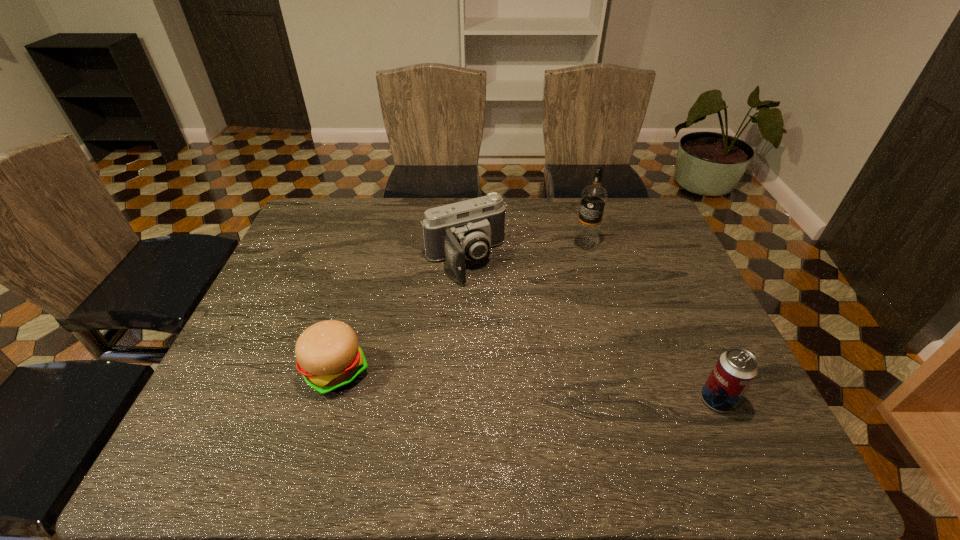
Identify the location of free point at the far edge. The height and width of the screenshot is (540, 960). (507, 205).

Locate an element on the screen. This screenshot has height=540, width=960. blank space at the near edge of the desktop is located at coordinates (468, 389).

The height and width of the screenshot is (540, 960). I want to click on free location at the left edge of the desktop, so click(x=275, y=323).

Find the location of a particular element. vacant region at the far left corner is located at coordinates (347, 198).

Locate an element on the screen. Image resolution: width=960 pixels, height=540 pixels. free space at the near left corner of the desktop is located at coordinates (x=209, y=417).

Where is `free space at the far right corner`? Image resolution: width=960 pixels, height=540 pixels. free space at the far right corner is located at coordinates (607, 207).

In order to click on vacant point located between the camera and the rightmost object in this screenshot , I will do `click(591, 330)`.

The height and width of the screenshot is (540, 960). Identify the location of free point between the leftmost object and the tallest object. (461, 307).

You are a GUI agent. You are given a task and a screenshot of the screen. Output one action in this format:
    pyautogui.click(x=<x>, y=<y>)
    Task: Click on the unoccupied area between the rightmost object and the camera
    
    Given the screenshot: What is the action you would take?
    pyautogui.click(x=591, y=330)

Locate an element on the screen. free space that is in between the rightmost object and the shortest object is located at coordinates (527, 385).